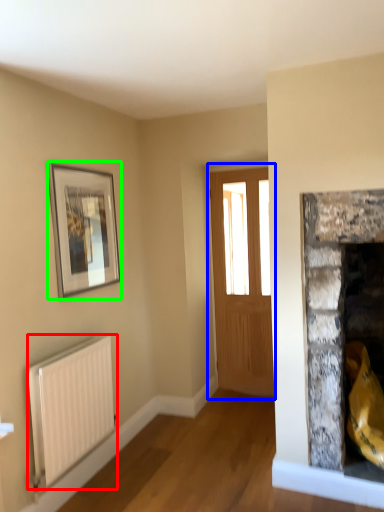
Question: Estimate the real-world distances between objects in this image. Which object is closer to radiator (highlighted by a red box), window (highlighted by a blue box) or picture frame (highlighted by a green box)?

Choices:
 (A) window
 (B) picture frame

Answer: (B)